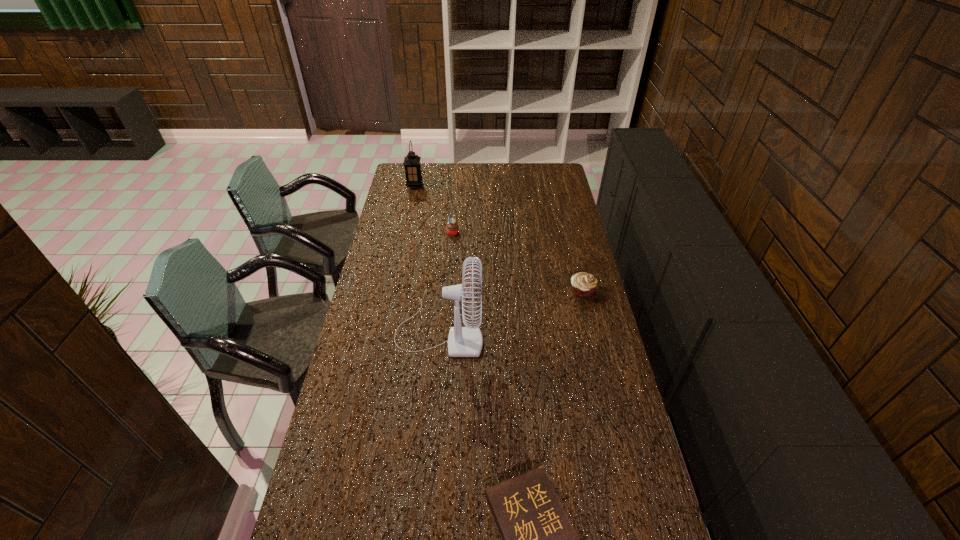
Where is `free space between the lantern and the nearer muffin`? free space between the lantern and the nearer muffin is located at coordinates (498, 239).

Locate an element on the screen. unoccupied area between the tallest object and the right muffin is located at coordinates (511, 311).

Image resolution: width=960 pixels, height=540 pixels. Find the location of `free space that is in between the rightmost object and the second farthest object`. free space that is in between the rightmost object and the second farthest object is located at coordinates (517, 261).

Locate an element on the screen. vacant point located between the fan and the farther muffin is located at coordinates (446, 281).

Identify the location of free space between the fan and the left muffin. The image size is (960, 540). click(446, 281).

The image size is (960, 540). I want to click on blank region between the tallest object and the farthest object, so click(427, 258).

Identify which object is the second closest to the fan. Please provide its 2D coordinates. Your answer should be formatted as a tuple, i.e. [(x, y)], where the tuple contains the x and y coordinates of a point satisfying the conditions above.

[(538, 539)]

Select which object is the third closest to the second farthest object. Please provide its 2D coordinates. Your answer should be formatted as a tuple, i.e. [(x, y)], where the tuple contains the x and y coordinates of a point satisfying the conditions above.

[(583, 284)]

Where is `free point that satisfies the following two spatial constraints: 1. on the front-facing side of the nearer muffin; 2. on the right side of the second farthest object`? The width and height of the screenshot is (960, 540). free point that satisfies the following two spatial constraints: 1. on the front-facing side of the nearer muffin; 2. on the right side of the second farthest object is located at coordinates click(448, 291).

Locate an element on the screen. This screenshot has width=960, height=540. blank area in the image that satisfies the following two spatial constraints: 1. on the front side of the rightmost object; 2. on the front-facing side of the tallest object is located at coordinates (592, 331).